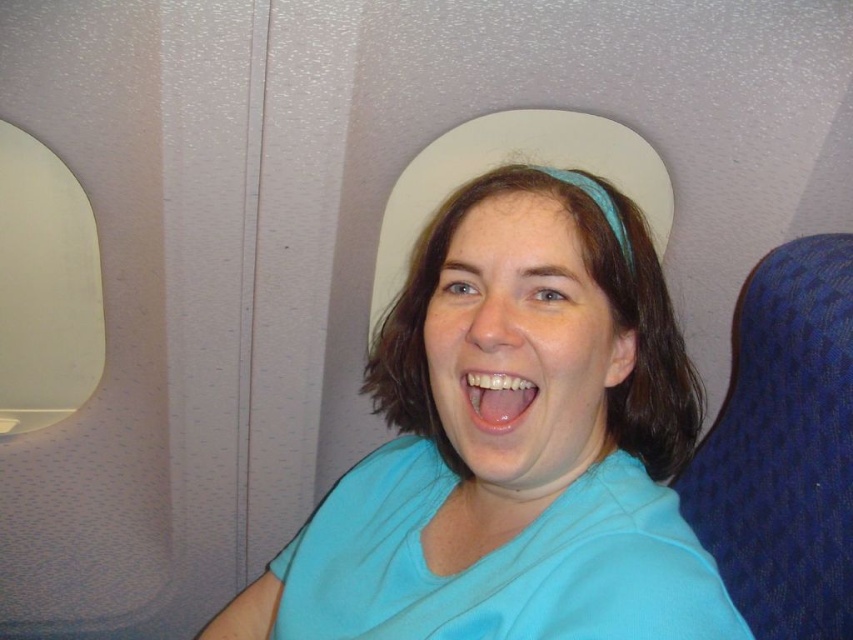
You are a flight attendant checking seat upholstery colors. You need to locate the light blue fabric at center. Where exactly is it positioned in the cabin?

The light blue fabric at center is positioned at point coordinates of (x=512, y=445).

You are a photographer trying to capture a closeup of the person seated in the airplane cabin. You want to focus on the point at coordinate point (x=505, y=544). Given that the camera can only focus on objects within 25 inches, will you be able to take the photo?

The point (x=505, y=544) is 24.92 inches away from the camera, which is within the 25 inches focus range. Therefore, the photographer can take the photo.

You are a flight attendant checking seat fabrics and passenger comfort. You notice the light blue fabric at center and the matte white teeth at center. Which object is positioned lower in the image?

The light blue fabric at center is positioned below matte white teeth at center, so the light blue fabric at center is lower in the image.